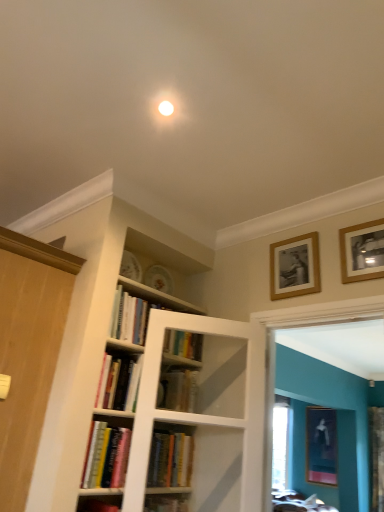
The height and width of the screenshot is (512, 384). Identify the location of hardcover book at center, which appears as the second book when ordered from the bottom. (178, 390).

The height and width of the screenshot is (512, 384). I want to click on wooden picture frame at upper right, which is the second picture frame in bottom-to-top order, so click(295, 267).

Find the location of a particular element. This screenshot has width=384, height=512. matte black picture frame at lower right, which is the third picture frame in front-to-back order is located at coordinates (321, 446).

The image size is (384, 512). What do you see at coordinates (130, 317) in the screenshot? I see `hardcover books at center, the first book viewed from the top` at bounding box center [130, 317].

I want to click on hardcover book at center, which appears as the second book when ordered from the bottom, so click(x=178, y=390).

Looking at this image, is wooden picture frame at upper right, positioned as the 1th picture frame in front-to-back order, in contact with wooden door at left?

wooden picture frame at upper right, positioned as the 1th picture frame in front-to-back order, is not next to wooden door at left, and they're not touching.

This screenshot has width=384, height=512. Find the location of `door in front of the wooden picture frame at upper right, arranged as the 2th picture frame when viewed from the left`. door in front of the wooden picture frame at upper right, arranged as the 2th picture frame when viewed from the left is located at coordinates click(28, 350).

How far apart are wooden picture frame at upper right, the second picture frame viewed from the right, and wooden door at left?

wooden picture frame at upper right, the second picture frame viewed from the right, and wooden door at left are 1.52 meters apart.

Would you say hardcover books at center, the first book viewed from the top, contains hardcover book at center, which appears as the third book when ordered from the bottom?

Actually, hardcover book at center, which appears as the third book when ordered from the bottom, is outside hardcover books at center, the first book viewed from the top.

Is hardcover books at center, the first book viewed from the top, turned away from hardcover book at center, which appears as the third book when ordered from the bottom?

That's not correct — hardcover books at center, the first book viewed from the top, is not looking away from hardcover book at center, which appears as the third book when ordered from the bottom.

Does hardcover books at center, the first book viewed from the top, have a lesser width compared to hardcover book at center, arranged as the second book when viewed from the top?

Indeed, hardcover books at center, the first book viewed from the top, has a lesser width compared to hardcover book at center, arranged as the second book when viewed from the top.

Based on the photo, between hardcover books at center, positioned as the 4th book in bottom-to-top order, and matte black picture frame at lower right, which appears as the 3th picture frame when viewed from the left, which one has larger size?

matte black picture frame at lower right, which appears as the 3th picture frame when viewed from the left, is bigger.

Is hardcover books at center, the first book viewed from the top, positioned far away from matte black picture frame at lower right, which is the third picture frame in front-to-back order?

Absolutely, hardcover books at center, the first book viewed from the top, is distant from matte black picture frame at lower right, which is the third picture frame in front-to-back order.

Between point (357, 267) and point (111, 448), which one is positioned behind?

The point (357, 267) is more distant.

Is wooden picture frame at upper right, arranged as the 2th picture frame when viewed from the left, far from hardcover books at lower left, the 1th book when ordered from bottom to top?

Yes, wooden picture frame at upper right, arranged as the 2th picture frame when viewed from the left, and hardcover books at lower left, the 1th book when ordered from bottom to top, are located far from each other.

Measure the distance from wooden picture frame at upper right, the 1th picture frame from the top, to hardcover books at lower left, the fourth book when ordered from top to bottom.

wooden picture frame at upper right, the 1th picture frame from the top, is 1.45 meters from hardcover books at lower left, the fourth book when ordered from top to bottom.

From the image's perspective, is wooden picture frame at upper right, positioned as the 1th picture frame in front-to-back order, below hardcover books at lower left, the 1th book when ordered from bottom to top?

No, from the image's perspective, wooden picture frame at upper right, positioned as the 1th picture frame in front-to-back order, is not below hardcover books at lower left, the 1th book when ordered from bottom to top.

Could you tell me if wooden door at left is turned towards wooden picture frame at upper right, positioned as the 2th picture frame in front-to-back order?

No.

At what (x,y) coordinates should I click in order to perform the action: click on door that appears in front of the wooden picture frame at upper right, the second picture frame from the top. Please return your answer as a coordinate pair (x, y). This screenshot has height=512, width=384. Looking at the image, I should click on (28, 350).

From a real-world perspective, is wooden door at left on top of wooden picture frame at upper right, the second picture frame from the top?

No.

Is the surface of wooden door at left in direct contact with wooden picture frame at upper right, placed as the third picture frame when sorted from right to left?

No, wooden door at left is not making contact with wooden picture frame at upper right, placed as the third picture frame when sorted from right to left.

From a real-world perspective, is matte black picture frame at lower right, which is the third picture frame in front-to-back order, physically above wooden picture frame at upper right, the second picture frame viewed from the right?

Actually, matte black picture frame at lower right, which is the third picture frame in front-to-back order, is physically below wooden picture frame at upper right, the second picture frame viewed from the right, in the real world.

Is matte black picture frame at lower right, positioned as the 1th picture frame in right-to-left order, bigger or smaller than wooden picture frame at upper right, arranged as the 2th picture frame when viewed from the left?

matte black picture frame at lower right, positioned as the 1th picture frame in right-to-left order, is bigger than wooden picture frame at upper right, arranged as the 2th picture frame when viewed from the left.

Between matte black picture frame at lower right, which appears as the 3th picture frame when viewed from the left, and wooden picture frame at upper right, arranged as the third picture frame when viewed from the back, which one appears on the left side from the viewer's perspective?

wooden picture frame at upper right, arranged as the third picture frame when viewed from the back.

From their relative heights in the image, would you say matte black picture frame at lower right, the 1th picture frame when ordered from back to front, is taller or shorter than wooden picture frame at upper right, arranged as the third picture frame when viewed from the back?

In the image, matte black picture frame at lower right, the 1th picture frame when ordered from back to front, appears to be taller than wooden picture frame at upper right, arranged as the third picture frame when viewed from the back.

Is point (105, 422) closer or farther from the camera than point (345, 231)?

Point (105, 422).

Is hardcover books at lower left, the 1th book when ordered from bottom to top, wider or thinner than wooden picture frame at upper right, positioned as the 1th picture frame in front-to-back order?

Clearly, hardcover books at lower left, the 1th book when ordered from bottom to top, has more width compared to wooden picture frame at upper right, positioned as the 1th picture frame in front-to-back order.

Can you confirm if hardcover books at lower left, the 1th book when ordered from bottom to top, is positioned to the left of wooden picture frame at upper right, the third picture frame when ordered from bottom to top?

Correct, you'll find hardcover books at lower left, the 1th book when ordered from bottom to top, to the left of wooden picture frame at upper right, the third picture frame when ordered from bottom to top.

From a real-world perspective, is hardcover books at lower left, the 1th book when ordered from bottom to top, positioned above or below wooden picture frame at upper right, positioned as the 1th picture frame in front-to-back order?

Clearly, from a real-world perspective, hardcover books at lower left, the 1th book when ordered from bottom to top, is below wooden picture frame at upper right, positioned as the 1th picture frame in front-to-back order.

This screenshot has width=384, height=512. Find the location of `door below the wooden picture frame at upper right, arranged as the 2th picture frame when viewed from the left (from a real-world perspective)`. door below the wooden picture frame at upper right, arranged as the 2th picture frame when viewed from the left (from a real-world perspective) is located at coordinates (28, 350).

Locate an element on the screen. The width and height of the screenshot is (384, 512). book lying above the hardcover book at center, arranged as the second book when viewed from the top (from the image's perspective) is located at coordinates (130, 317).

Which object lies further to the anchor point matte black picture frame at lower right, the first picture frame positioned from the bottom, wooden picture frame at upper right, positioned as the 2th picture frame in front-to-back order, or hardcover books at lower left, the fourth book when ordered from top to bottom?

The object further to matte black picture frame at lower right, the first picture frame positioned from the bottom, is hardcover books at lower left, the fourth book when ordered from top to bottom.

Considering their positions, is wooden picture frame at upper right, which is the second picture frame in bottom-to-top order, positioned closer to wooden door at left than wooden picture frame at upper right, the 1th picture frame from the top?

wooden picture frame at upper right, which is the second picture frame in bottom-to-top order, lies closer to wooden door at left than the other object.

When comparing their distances from hardcover books at lower left, the fourth book when ordered from top to bottom, does hardcover books at center, positioned as the 4th book in bottom-to-top order, or wooden picture frame at upper right, arranged as the 2th picture frame when viewed from the left, seem further?

wooden picture frame at upper right, arranged as the 2th picture frame when viewed from the left.

Estimate the real-world distances between objects in this image. Which object is closer to hardcover books at lower left, the fourth book when ordered from top to bottom, hardcover books at center, the first book viewed from the top, or wooden door at left?

wooden door at left.

Which object lies nearer to the anchor point wooden picture frame at upper right, the third picture frame when ordered from bottom to top, hardcover books at lower left, the 1th book when ordered from bottom to top, or wooden door at left?

hardcover books at lower left, the 1th book when ordered from bottom to top, is closer to wooden picture frame at upper right, the third picture frame when ordered from bottom to top.

Looking at the image, which one is located further to matte black picture frame at lower right, which is the third picture frame in front-to-back order, hardcover books at center, the first book viewed from the top, or hardcover book at center, marked as the third book in a top-to-bottom arrangement?

Among the two, hardcover books at center, the first book viewed from the top, is located further to matte black picture frame at lower right, which is the third picture frame in front-to-back order.

Considering their positions, is wooden picture frame at upper right, the 2th picture frame in the back-to-front sequence, positioned closer to wooden picture frame at upper right, the second picture frame viewed from the right, than hardcover books at lower left, the fourth book when ordered from top to bottom?

Among the two, wooden picture frame at upper right, the 2th picture frame in the back-to-front sequence, is located nearer to wooden picture frame at upper right, the second picture frame viewed from the right.

Estimate the real-world distances between objects in this image. Which object is closer to hardcover book at center, which appears as the second book when ordered from the bottom, hardcover books at lower left, the fourth book when ordered from top to bottom, or wooden picture frame at upper right, the second picture frame viewed from the right?

hardcover books at lower left, the fourth book when ordered from top to bottom.

Find the location of `book between wooden picture frame at upper right, the second picture frame from the top, and matte black picture frame at lower right, which appears as the 3th picture frame when viewed from the left, in the front-back direction`. book between wooden picture frame at upper right, the second picture frame from the top, and matte black picture frame at lower right, which appears as the 3th picture frame when viewed from the left, in the front-back direction is located at coordinates (178, 390).

Locate an element on the screen. The image size is (384, 512). book between hardcover books at center, the first book viewed from the top, and hardcover book at center, marked as the third book in a top-to-bottom arrangement, in the vertical direction is located at coordinates (119, 384).

Locate an element on the screen. book situated between hardcover books at center, positioned as the 4th book in bottom-to-top order, and wooden picture frame at upper right, arranged as the third picture frame when viewed from the back, from left to right is located at coordinates (178, 390).

What are the coordinates of `picture frame between wooden door at left and wooden picture frame at upper right, positioned as the 1th picture frame in front-to-back order, in the horizontal direction` in the screenshot? It's located at (295, 267).